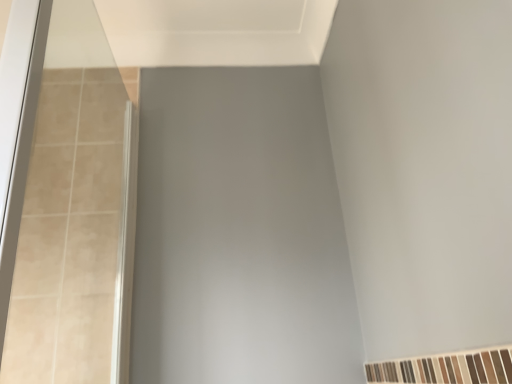
Where is `clear glass screen door at left`? Image resolution: width=512 pixels, height=384 pixels. clear glass screen door at left is located at coordinates (70, 212).

Describe the element at coordinates (70, 212) in the screenshot. I see `clear glass screen door at left` at that location.

Locate an element on the screen. Image resolution: width=512 pixels, height=384 pixels. clear glass screen door at left is located at coordinates (70, 212).